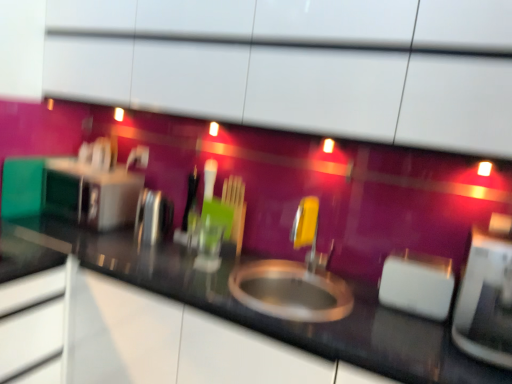
Question: Considering the relative positions of satin silver toaster at left, the 4th appliance positioned from the front, and black glossy countertop at center in the image provided, is satin silver toaster at left, the 4th appliance positioned from the front, to the left of black glossy countertop at center from the viewer's perspective?

Choices:
 (A) no
 (B) yes

Answer: (B)

Question: Is satin silver toaster at left, which is the 1th appliance in back-to-front order, positioned far away from black glossy countertop at center?

Choices:
 (A) yes
 (B) no

Answer: (B)

Question: Can you confirm if satin silver toaster at left, the 1th appliance viewed from the left, is taller than black glossy countertop at center?

Choices:
 (A) yes
 (B) no

Answer: (B)

Question: From the image's perspective, would you say satin silver toaster at left, marked as the fourth appliance in a right-to-left arrangement, is shown under black glossy countertop at center?

Choices:
 (A) no
 (B) yes

Answer: (A)

Question: Is black glossy countertop at center inside satin silver toaster at left, the 1th appliance viewed from the left?

Choices:
 (A) no
 (B) yes

Answer: (A)

Question: Is satin silver toaster at left, which is the 1th appliance in back-to-front order, wider than black glossy countertop at center?

Choices:
 (A) yes
 (B) no

Answer: (B)

Question: Considering the relative sizes of white plastic toaster at right, which ranks as the third appliance in left-to-right order, and black glossy countertop at center in the image provided, is white plastic toaster at right, which ranks as the third appliance in left-to-right order, shorter than black glossy countertop at center?

Choices:
 (A) yes
 (B) no

Answer: (A)

Question: Does white plastic toaster at right, the second appliance when ordered from right to left, appear on the left side of black glossy countertop at center?

Choices:
 (A) no
 (B) yes

Answer: (A)

Question: Considering the relative sizes of white plastic toaster at right, which ranks as the third appliance in back-to-front order, and black glossy countertop at center in the image provided, is white plastic toaster at right, which ranks as the third appliance in back-to-front order, taller than black glossy countertop at center?

Choices:
 (A) no
 (B) yes

Answer: (A)

Question: Can you confirm if white plastic toaster at right, arranged as the 2th appliance when viewed from the front, is wider than black glossy countertop at center?

Choices:
 (A) no
 (B) yes

Answer: (A)

Question: Is white plastic toaster at right, which ranks as the third appliance in back-to-front order, surrounding black glossy countertop at center?

Choices:
 (A) no
 (B) yes

Answer: (A)

Question: From the image's perspective, is white plastic toaster at right, which ranks as the third appliance in left-to-right order, over black glossy countertop at center?

Choices:
 (A) yes
 (B) no

Answer: (A)

Question: Can you confirm if satin silver toaster at left, the 4th appliance positioned from the front, is smaller than polished stainless steel kettle at left, arranged as the 2th appliance when viewed from the back?

Choices:
 (A) yes
 (B) no

Answer: (B)